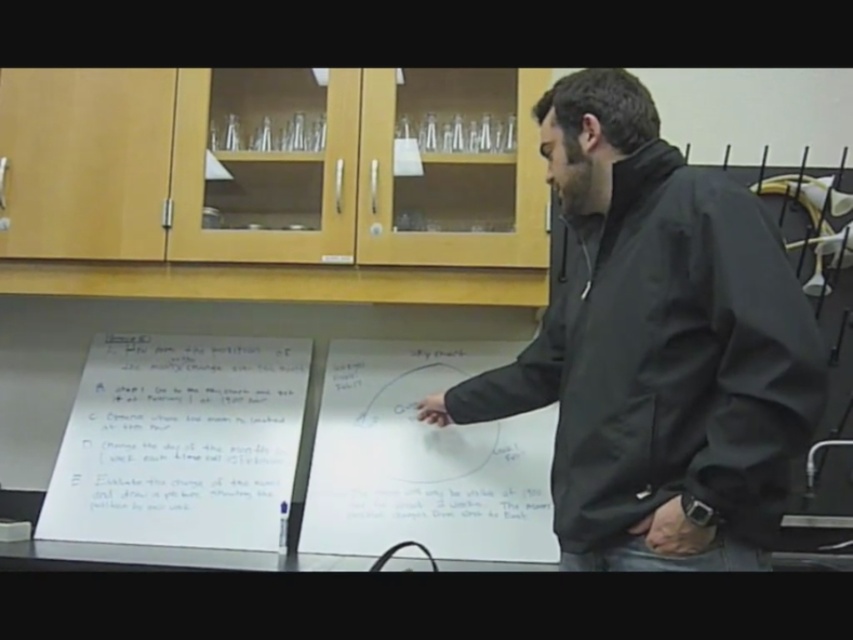
Looking at this image, you are a student in the classroom and need to determine which object is taller between the black matte jacket at center and the white paper at center. Which one is taller?

The black matte jacket at center is taller than the white paper at center according to the description.

You are a student in the classroom and need to write down notes. Which object, the white paper at center or the white matte board at center, has a larger writing area?

The white paper at center has a larger writing area because its width surpasses that of the white matte board at center.